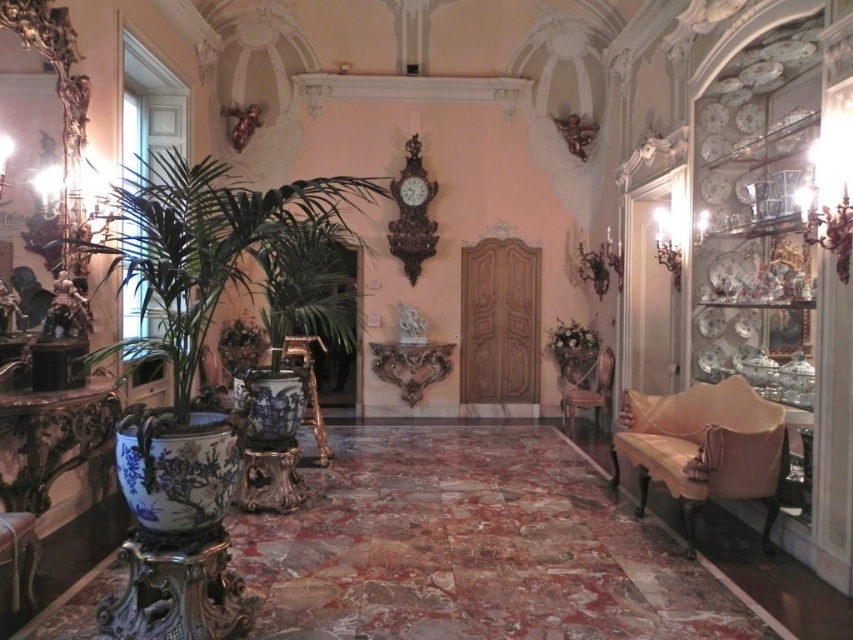
You are a decorator arranging a space. You have a blue glazed pot at left and a velvet beige armchair at right. Which object is taller?

The blue glazed pot at left is taller than the velvet beige armchair at right.

You are a delivery person carrying a package that is 2.5 meters long. You need to navigate through the space between the blue glazed pot at left and the velvet beige armchair at right. Can you pass through this space with your package without tilting it?

The distance between the blue glazed pot at left and the velvet beige armchair at right is 3.09 meters. Since the package is 2.5 meters long, which is shorter than the available space, you can pass through the space without tilting the package.

You are an interior designer assessing the space for a client who wants to ensure that all items in the room are proportional to each other. Given the polished bronze clock at upper center and the wooden armchair at right, which object should be considered the larger one for balancing the room design?

The wooden armchair at right is larger than the polished bronze clock at upper center, so it should be considered the larger one for balancing the room design.